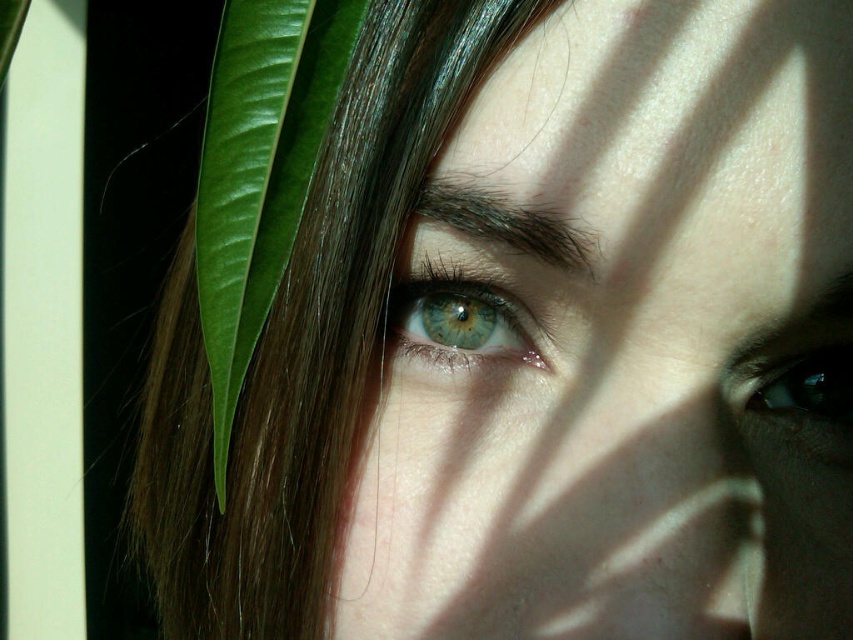
Between green glossy leaf at left and green matte eye at center, which one is positioned lower?

Positioned lower is green glossy leaf at left.

Which is behind, point (300, 172) or point (428, 328)?

Point (428, 328)

The height and width of the screenshot is (640, 853). In order to click on green glossy leaf at left in this screenshot , I will do `click(258, 172)`.

Is green matte eye at center taller than green matte eye at right?

Yes.

Which is above, green matte eye at center or green matte eye at right?

Positioned higher is green matte eye at center.

What do you see at coordinates (459, 323) in the screenshot? I see `green matte eye at center` at bounding box center [459, 323].

Where is `green matte eye at center`? green matte eye at center is located at coordinates (459, 323).

Does green glossy leaf at left have a larger size compared to green matte eye at right?

Yes, green glossy leaf at left is bigger than green matte eye at right.

Who is more distant from viewer, (306, 120) or (833, 380)?

The point (833, 380) is more distant.

Identify the location of green glossy leaf at left. (258, 172).